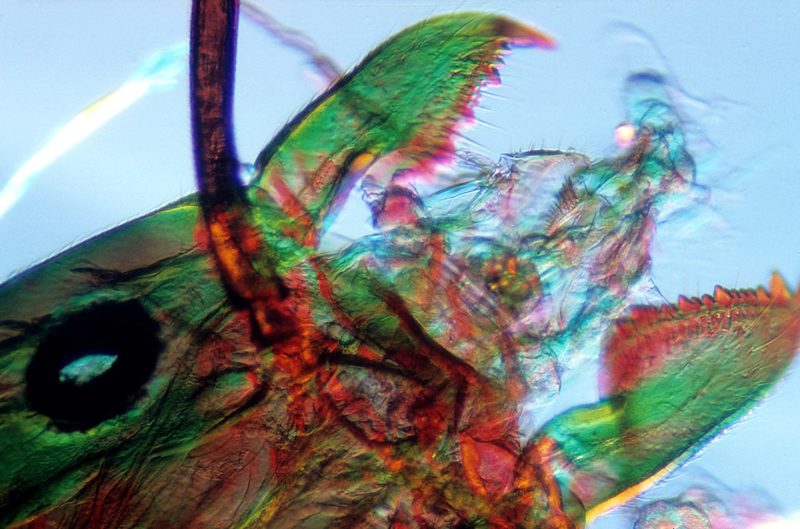
At what (x,y) coordinates should I click in order to perform the action: click on light source. Please return your answer as a coordinate pair (x, y). The height and width of the screenshot is (529, 800). Looking at the image, I should click on (77, 142).